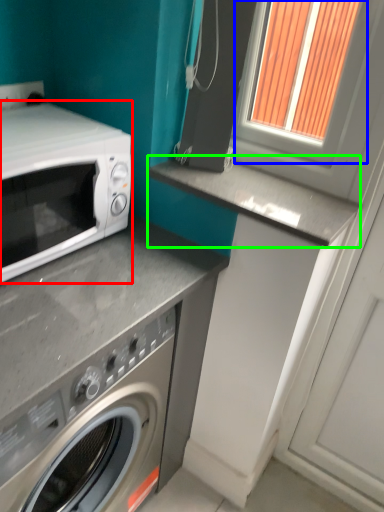
Question: Based on their relative distances, which object is nearer to microwave oven (highlighted by a red box)? Choose from window frame (highlighted by a blue box) and counter top (highlighted by a green box).

Choices:
 (A) window frame
 (B) counter top

Answer: (B)